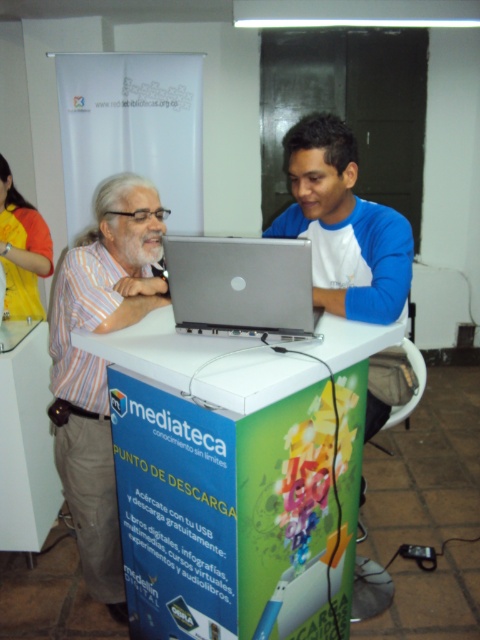
Consider the image. You are a person with a 12 inch wide backpack. You want to place it between the white plastic table at center and the striped cotton shirt at left. Will it fit?

The distance between the white plastic table at center and the striped cotton shirt at left is 15.28 inches. Since your backpack is 12 inches wide, it will fit comfortably in the space provided.

You are a visitor at the mediateca and want to place your silver metallic laptop at center on the white plastic table at center. Can you do this without moving the existing items on the table?

The white plastic table at center is closer to the viewer than the silver metallic laptop at center, so the laptop is already placed on the table.

What are the coordinates of the silver metallic laptop at center?

The silver metallic laptop at center is located at coordinates point (241, 285).